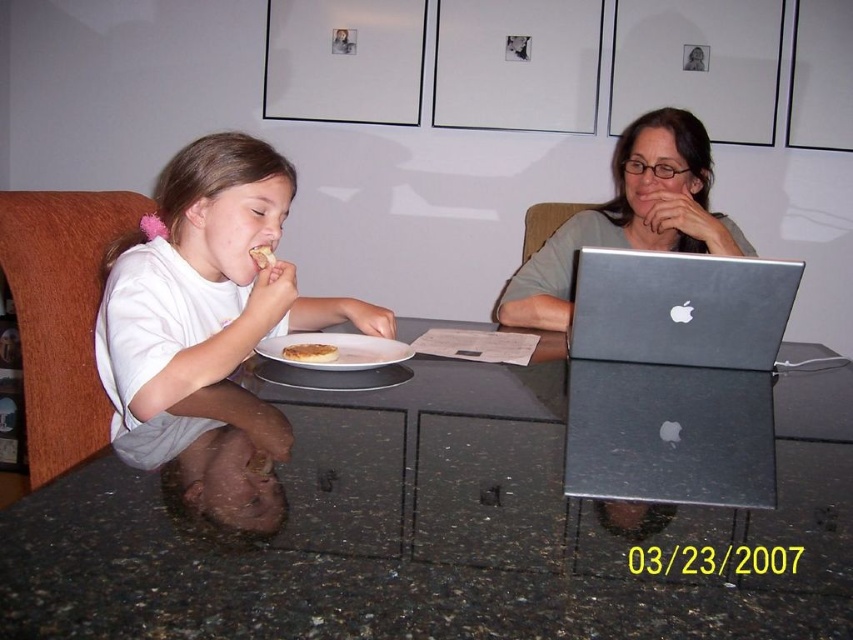
Looking at this image, which is more to the left, black granite table at center or golden brown bread at center?

From the viewer's perspective, golden brown bread at center appears more on the left side.

Can you confirm if black granite table at center is positioned to the right of golden brown bread at center?

Indeed, black granite table at center is positioned on the right side of golden brown bread at center.

Who is more forward, (693, 516) or (318, 348)?

Point (693, 516) is in front.

What are the coordinates of `black granite table at center` in the screenshot? It's located at (439, 531).

Measure the distance from white matte shirt at left to golden brown bread at center.

The distance of white matte shirt at left from golden brown bread at center is 9.54 inches.

Is white matte shirt at left behind golden brown bread at center?

No, it is in front of golden brown bread at center.

Find the location of a particular element. The width and height of the screenshot is (853, 640). white matte shirt at left is located at coordinates (206, 280).

Can you confirm if silver metallic laptop at center is bigger than white matte plate at center?

Correct, silver metallic laptop at center is larger in size than white matte plate at center.

Measure the distance between silver metallic laptop at center and white matte plate at center.

silver metallic laptop at center and white matte plate at center are 16.68 inches apart.

Which is behind, point (579, 260) or point (344, 340)?

The point (344, 340) is more distant.

What are the coordinates of `silver metallic laptop at center` in the screenshot? It's located at (680, 308).